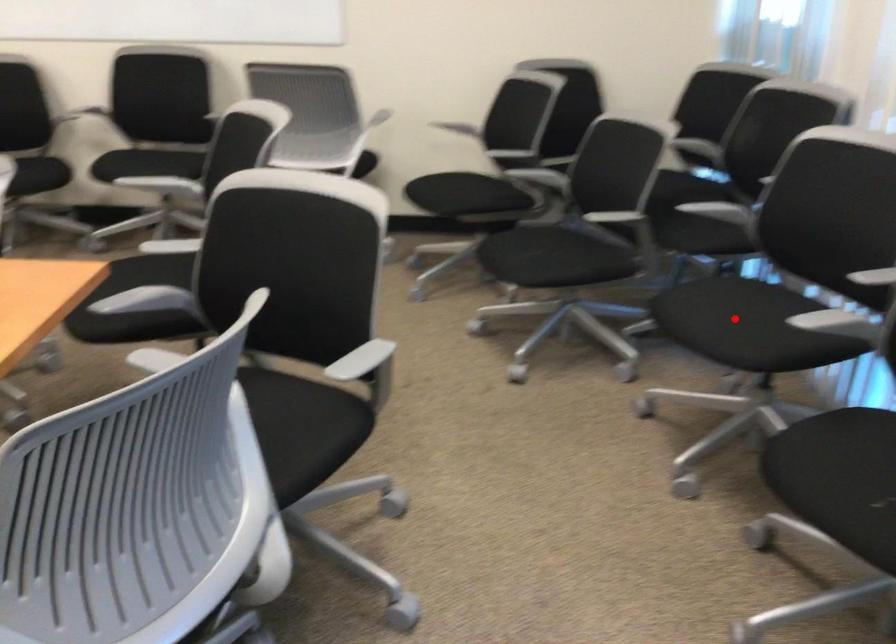
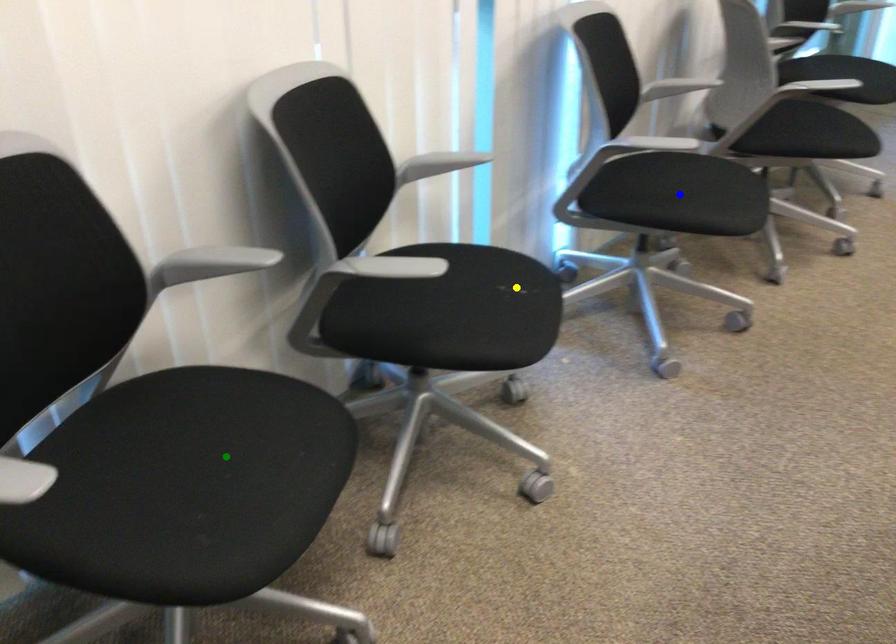
Question: I am providing you with two images of the same scene from different viewpoints. A red point is marked on the first image. You are given multiple points on the second image. Can you choose the point in image 2 that corresponds to the point in image 1?

Choices:
 (A) yellow point
 (B) blue point
 (C) green point

Answer: (C)